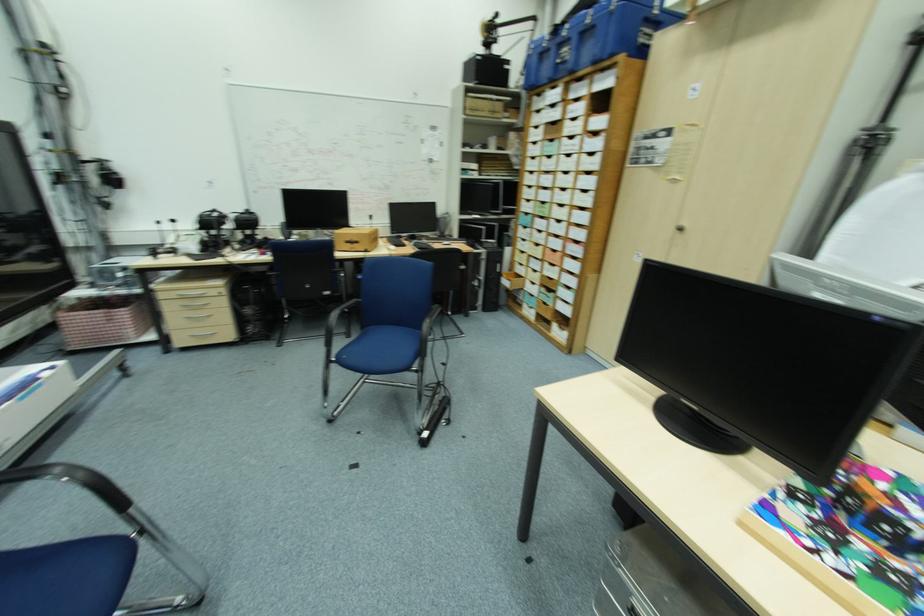
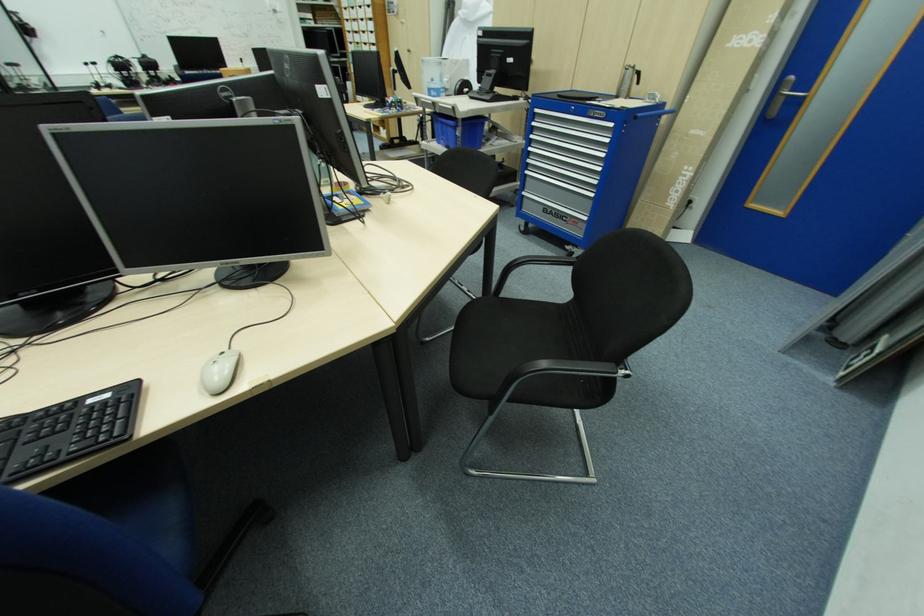
Question: In a continuous first-person perspective shot, in which direction is the camera moving?

Choices:
 (A) Left
 (B) Right
 (C) Forward
 (D) Backward

Answer: (D)